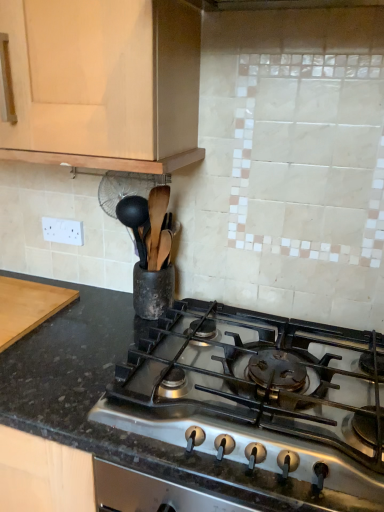
Identify the location of wooden cutting board at left. (28, 306).

Does matte wood cabinet at upper left have a lesser height compared to wooden cutting board at left?

No, matte wood cabinet at upper left is not shorter than wooden cutting board at left.

Can you tell me how much matte wood cabinet at upper left and wooden cutting board at left differ in facing direction?

The angular difference between matte wood cabinet at upper left and wooden cutting board at left is 1.15 degrees.

Is matte wood cabinet at upper left facing away from wooden cutting board at left?

No, wooden cutting board at left is not at the back of matte wood cabinet at upper left.

Considering the positions of objects matte wood cabinet at upper left and black granite countertop at center in the image provided, who is more to the left, matte wood cabinet at upper left or black granite countertop at center?

matte wood cabinet at upper left is more to the left.

Can you confirm if matte wood cabinet at upper left is bigger than black granite countertop at center?

Indeed, matte wood cabinet at upper left has a larger size compared to black granite countertop at center.

Are matte wood cabinet at upper left and black granite countertop at center beside each other?

No, matte wood cabinet at upper left is not in contact with black granite countertop at center.

Can you confirm if wooden cutting board at left is positioned to the right of matte wood cabinet at upper left?

No, wooden cutting board at left is not to the right of matte wood cabinet at upper left.

From a real-world perspective, does wooden cutting board at left stand above matte wood cabinet at upper left?

No, from a real-world perspective, wooden cutting board at left is not over matte wood cabinet at upper left

How different are the orientations of wooden cutting board at left and matte wood cabinet at upper left in degrees?

There is a 1.15-degree angle between the facing directions of wooden cutting board at left and matte wood cabinet at upper left.

Which is in front, point (16, 286) or point (199, 156)?

The point (199, 156) is closer to the camera.

Where is `cutting board behind the black granite countertop at center`? Image resolution: width=384 pixels, height=512 pixels. cutting board behind the black granite countertop at center is located at coordinates (28, 306).

Which object is positioned more to the left, wooden cutting board at left or black granite countertop at center?

From the viewer's perspective, wooden cutting board at left appears more on the left side.

Would you say wooden cutting board at left contains black granite countertop at center?

Actually, black granite countertop at center is outside wooden cutting board at left.

Is wooden cutting board at left not near black granite countertop at center?

No, wooden cutting board at left is not far from black granite countertop at center.

Which of these two, black granite countertop at center or wooden cutting board at left, is wider?

black granite countertop at center is wider.

The image size is (384, 512). What are the coordinates of `countertop that is above the wooden cutting board at left (from a real-world perspective)` in the screenshot? It's located at (198, 407).

Does point (223, 342) come farther from viewer compared to point (65, 298)?

That is False.

Is black granite countertop at center outside of matte wood cabinet at upper left?

black granite countertop at center is positioned outside matte wood cabinet at upper left.

Between black granite countertop at center and matte wood cabinet at upper left, which one is positioned in front?

black granite countertop at center is closer to the camera.

From the picture: Which of these two, black granite countertop at center or matte wood cabinet at upper left, is bigger?

matte wood cabinet at upper left.

Does point (40, 382) come behind point (136, 109)?

Yes, point (40, 382) is behind point (136, 109).

Where is `cutting board on the left of matte wood cabinet at upper left`? This screenshot has width=384, height=512. cutting board on the left of matte wood cabinet at upper left is located at coordinates (28, 306).

Where is `cabinetry behind the black granite countertop at center`? The height and width of the screenshot is (512, 384). cabinetry behind the black granite countertop at center is located at coordinates (103, 83).

Which object lies nearer to the anchor point black granite countertop at center, matte wood cabinet at upper left or wooden cutting board at left?

wooden cutting board at left is positioned closer to the anchor black granite countertop at center.

Based on their spatial positions, is black granite countertop at center or matte wood cabinet at upper left closer to wooden cutting board at left?

The object closer to wooden cutting board at left is black granite countertop at center.

Which object lies nearer to the anchor point wooden cutting board at left, matte wood cabinet at upper left or black granite countertop at center?

black granite countertop at center is positioned closer to the anchor wooden cutting board at left.

Which object lies further to the anchor point matte wood cabinet at upper left, wooden cutting board at left or black granite countertop at center?

wooden cutting board at left is further to matte wood cabinet at upper left.

Looking at the image, which one is located closer to matte wood cabinet at upper left, black granite countertop at center or wooden cutting board at left?

black granite countertop at center lies closer to matte wood cabinet at upper left than the other object.

Looking at this image, when comparing their distances from black granite countertop at center, does wooden cutting board at left or matte wood cabinet at upper left seem closer?

wooden cutting board at left.

You are a GUI agent. You are given a task and a screenshot of the screen. Output one action in this format:
    pyautogui.click(x=<x>, y=<y>)
    Task: Click on the cutting board between matte wood cabinet at upper left and black granite countertop at center vertically
    
    Given the screenshot: What is the action you would take?
    pyautogui.click(x=28, y=306)